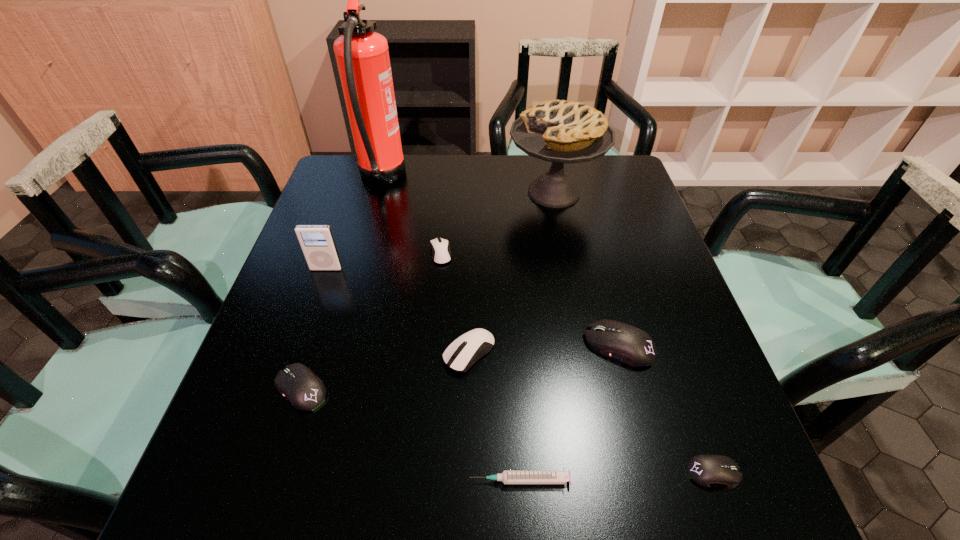
This screenshot has width=960, height=540. I want to click on fire extinguisher, so click(x=362, y=55).

This screenshot has width=960, height=540. I want to click on the tallest object, so (362, 55).

The image size is (960, 540). I want to click on pie, so click(558, 131).

Identify the location of iPod. (317, 242).

The image size is (960, 540). I want to click on the fourth farthest object, so click(317, 242).

The width and height of the screenshot is (960, 540). Identify the location of the biggest black computer equipment. (628, 344).

Locate an element on the screen. Image resolution: width=960 pixels, height=540 pixels. the bigger white mouse is located at coordinates (468, 348).

Where is `the leftmost computer equipment`? Image resolution: width=960 pixels, height=540 pixels. the leftmost computer equipment is located at coordinates (305, 391).

What are the coordinates of `the leftmost black computer equipment` in the screenshot? It's located at (305, 391).

Find the location of `the farther white mouse`. the farther white mouse is located at coordinates (441, 254).